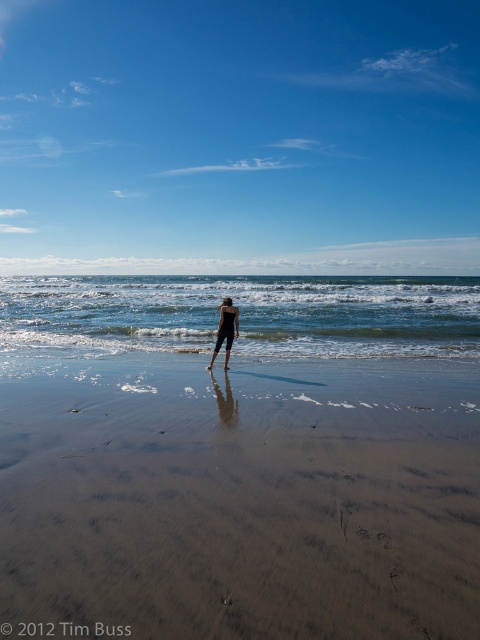
You are a photographer trying to capture the reflection of the black matte swimsuit at center in the sandy brown at lower center. Based on the scene description, which direction should you move to ensure the reflection is fully visible in the photo?

The sandy brown at lower center is to the right of the black matte swimsuit at center, so you should move to the right side of the swimsuit to capture its reflection in the sandy brown area.

You are standing on the beach and see two points marked on the sand. Which point is closer to you, the point at coordinates point (470, 561) or the point at coordinates point (219, 332)?

Point (470, 561) is closer to the viewer than point (219, 332).